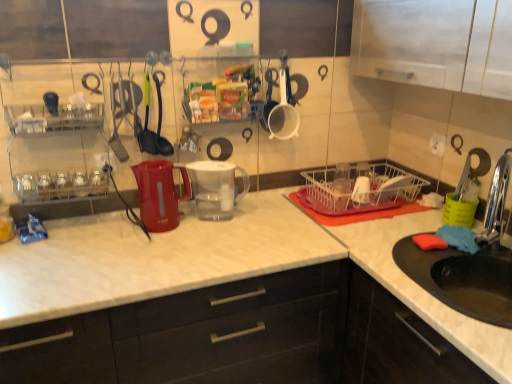
You are a GUI agent. You are given a task and a screenshot of the screen. Output one action in this format:
    pyautogui.click(x=<x>, y=<y>)
    Task: Click on the vacant area that is in front of transparent plastic water filter pitcher at center, acting as the 1th appliance starting from the right
    
    Given the screenshot: What is the action you would take?
    pyautogui.click(x=215, y=236)